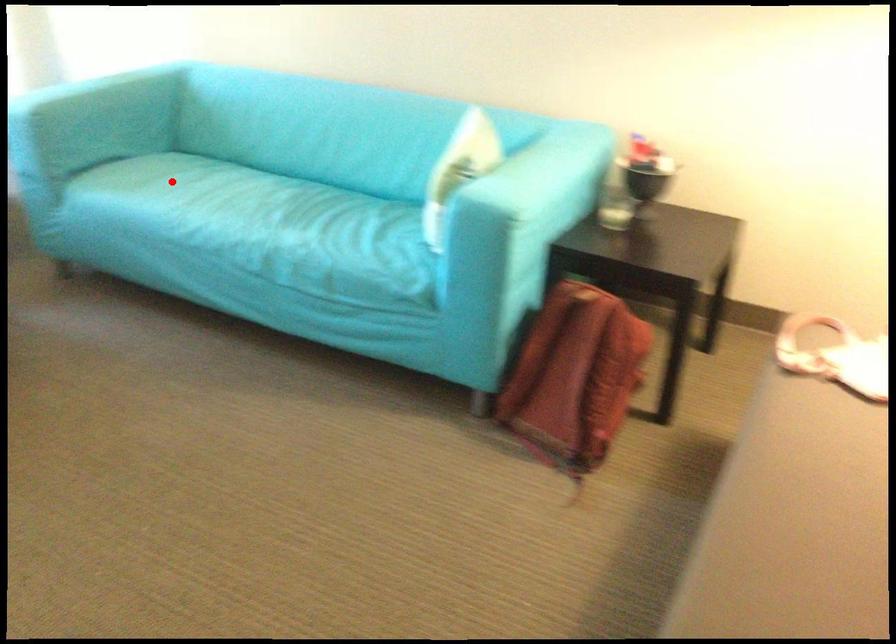
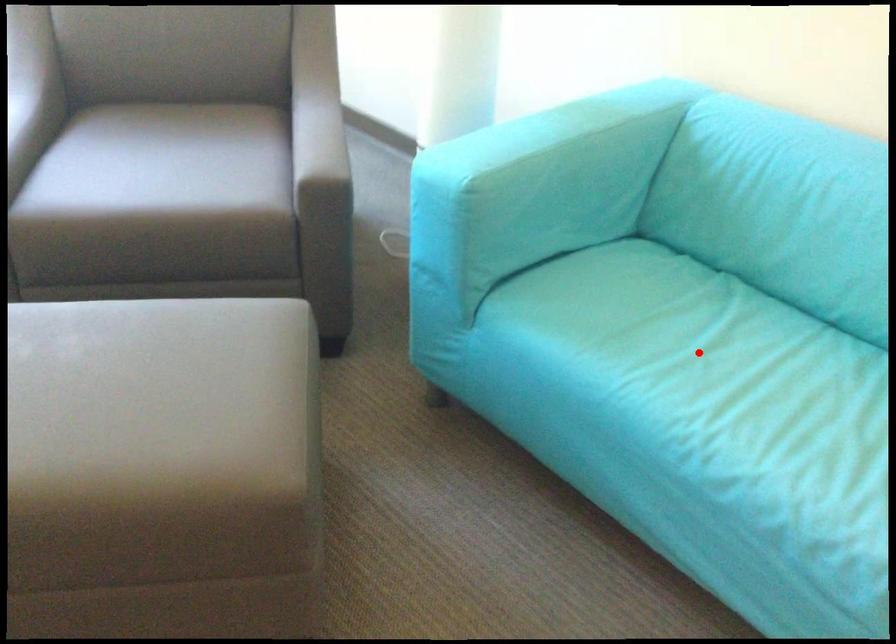
I am providing you with two images of the same scene from different viewpoints. A red point is marked on the first image and another point is marked on the second image. Is the red point in image1 aligned with the point shown in image2?

Yes